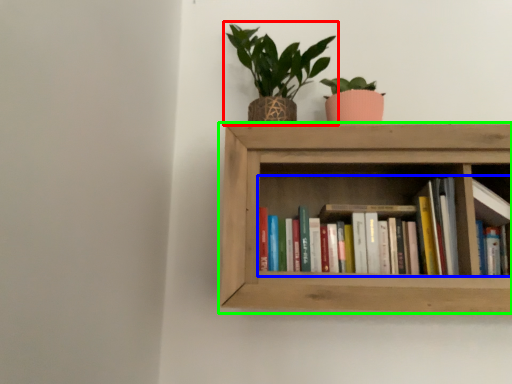
Question: Estimate the real-world distances between objects in this image. Which object is closer to houseplant (highlighted by a red box), book (highlighted by a blue box) or shelf (highlighted by a green box)?

Choices:
 (A) book
 (B) shelf

Answer: (B)